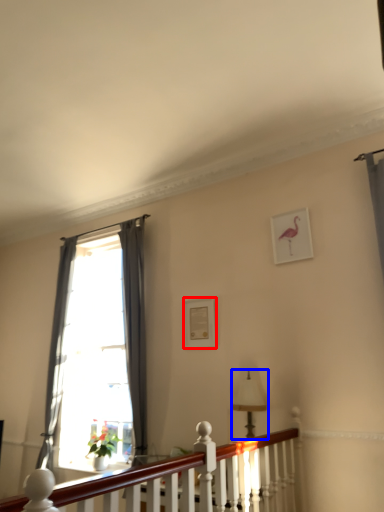
Question: Which of the following is the closest to the observer, picture frame (highlighted by a red box) or lamp (highlighted by a blue box)?

Choices:
 (A) picture frame
 (B) lamp

Answer: (B)